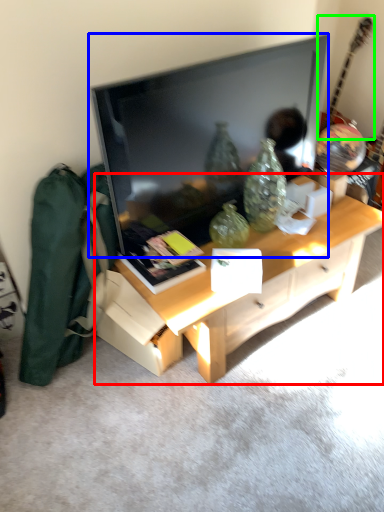
Question: Which object is the farthest from desk (highlighted by a red box)? Choose among these: television (highlighted by a blue box) or guitar (highlighted by a green box).

Choices:
 (A) television
 (B) guitar

Answer: (B)